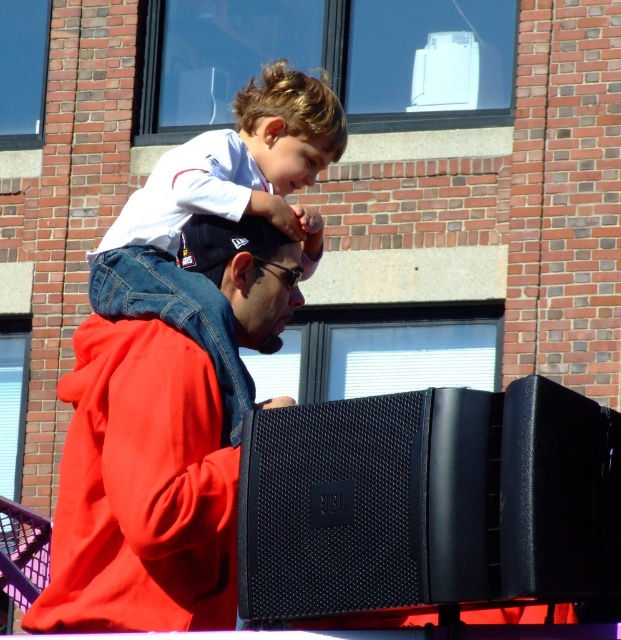
You are a photographer at the event and want to ensure both the matte red hoodie at center and the white matte shirt at upper center are clearly visible in your photo. Since you can only focus on one subject, which one should you choose to ensure the other remains in the background without blurring?

The matte red hoodie at center has a lesser width compared to white matte shirt at upper center. Therefore, focusing on the wider white matte shirt at upper center would keep the narrower matte red hoodie at center in the background without blurring.

You are setting up for a music event and need to place a 1.5 meter tall amplifier next to the existing equipment. Given the space where the black mesh speaker at lower right and the matte red hoodie at center are located, will there be enough vertical space for the amplifier?

The black mesh speaker at lower right is not as tall as the matte red hoodie at center, but since the hoodie is worn by a person, its height isn

You are organizing a photo shoot and need to ensure that the matte red hoodie at center and the white matte shirt at upper center are both visible in the frame. Based on their sizes, which object might require more careful framing to avoid being too small in the shot?

The matte red hoodie at center occupies less space than the white matte shirt at upper center, so it might require more careful framing to ensure it is not too small in the shot.